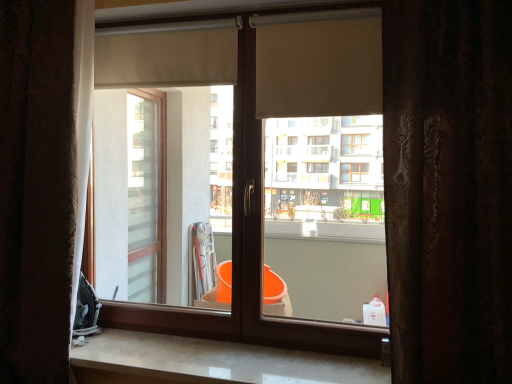
Question: Should I look upward or downward to see matte wood window at center?

Choices:
 (A) down
 (B) up

Answer: (B)

Question: Considering the relative sizes of brown textured curtain at left, acting as the 1th curtain starting from the left, and white marble counter top at lower center in the image provided, is brown textured curtain at left, acting as the 1th curtain starting from the left, taller than white marble counter top at lower center?

Choices:
 (A) no
 (B) yes

Answer: (B)

Question: Is brown textured curtain at left, acting as the 1th curtain starting from the left, at the left side of white marble counter top at lower center?

Choices:
 (A) yes
 (B) no

Answer: (A)

Question: Does brown textured curtain at left, acting as the 1th curtain starting from the left, appear on the right side of white marble counter top at lower center?

Choices:
 (A) no
 (B) yes

Answer: (A)

Question: Is brown textured curtain at left, which is counted as the 2th curtain, starting from the right, smaller than white marble counter top at lower center?

Choices:
 (A) no
 (B) yes

Answer: (A)

Question: Is brown textured curtain at left, which appears as the 2th curtain when viewed from the front, not close to white marble counter top at lower center?

Choices:
 (A) yes
 (B) no

Answer: (B)

Question: Does brown textured curtain at left, marked as the 1th curtain in a back-to-front arrangement, come behind white marble counter top at lower center?

Choices:
 (A) no
 (B) yes

Answer: (B)

Question: Can you see beige fabric roller at upper center, the 1th shutter when ordered from front to back, touching matte wood window at center?

Choices:
 (A) yes
 (B) no

Answer: (B)

Question: Is beige fabric roller at upper center, the 1th shutter when ordered from front to back, shorter than matte wood window at center?

Choices:
 (A) yes
 (B) no

Answer: (A)

Question: Is beige fabric roller at upper center, the 1th shutter when ordered from front to back, far away from matte wood window at center?

Choices:
 (A) no
 (B) yes

Answer: (A)

Question: From a real-world perspective, is beige fabric roller at upper center, which appears as the second shutter when viewed from the left, positioned under matte wood window at center based on gravity?

Choices:
 (A) no
 (B) yes

Answer: (A)

Question: Is beige fabric roller at upper center, which appears as the second shutter when viewed from the left, facing towards matte wood window at center?

Choices:
 (A) no
 (B) yes

Answer: (B)

Question: Can you confirm if beige fabric roller at upper center, which appears as the second shutter when viewed from the left, is smaller than matte wood window at center?

Choices:
 (A) yes
 (B) no

Answer: (A)

Question: Is beige fabric roller at upper center, the first shutter viewed from the right, shorter than brown textured curtain at left, acting as the 1th curtain starting from the left?

Choices:
 (A) yes
 (B) no

Answer: (A)